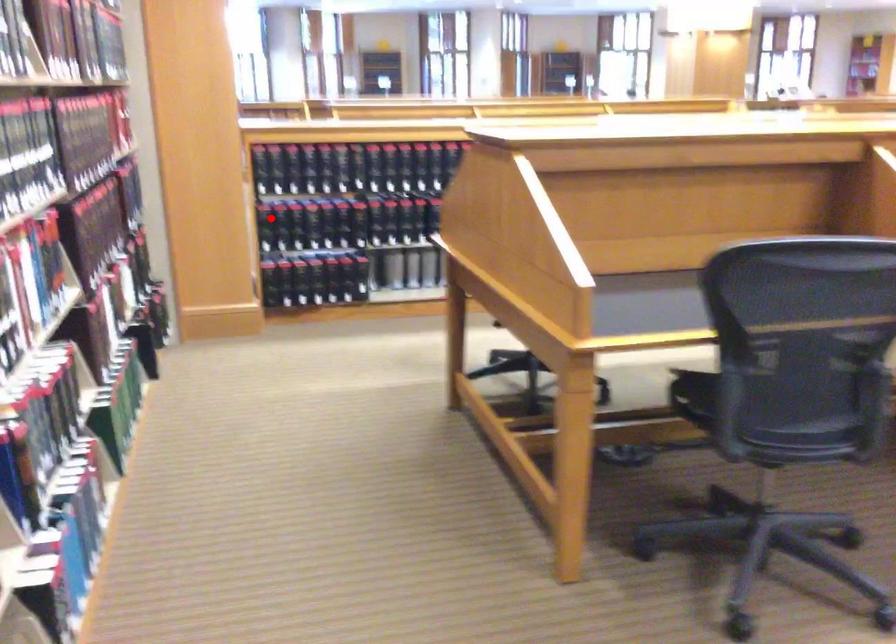
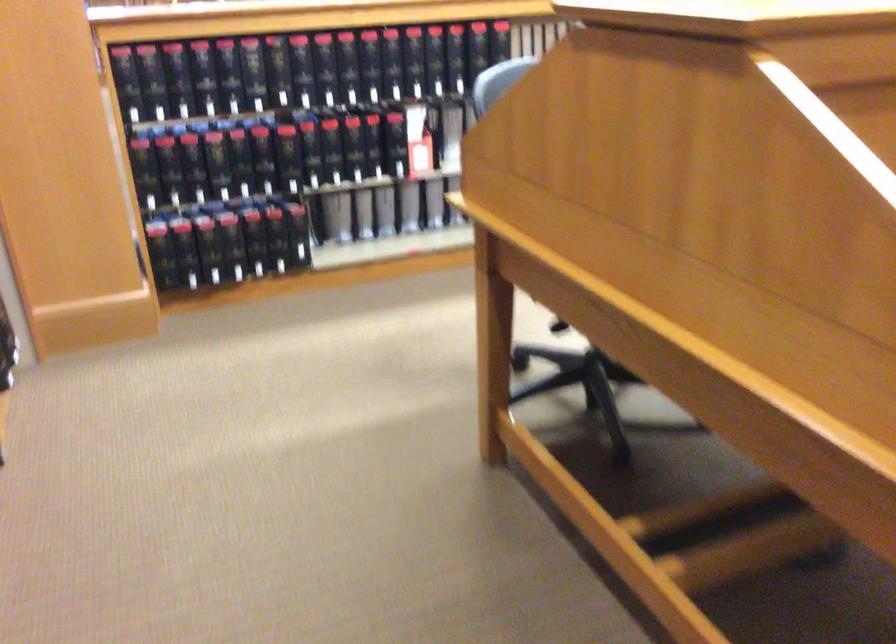
The point at the highlighted location is marked in the first image. Where is the corresponding point in the second image?

(161, 167)